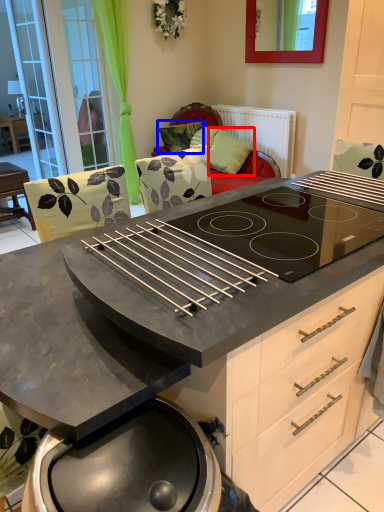
Question: Which point is closer to the camera, pillow (highlighted by a red box) or pillow (highlighted by a blue box)?

Choices:
 (A) pillow
 (B) pillow

Answer: (A)